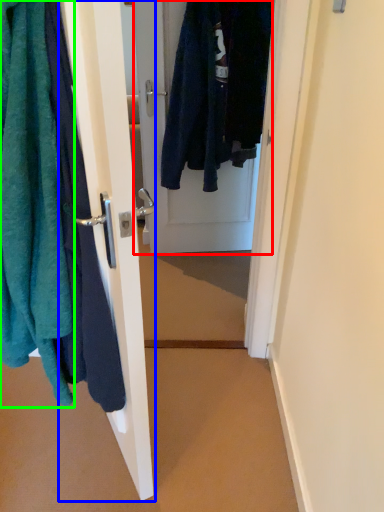
Question: Which object is the closest to the door (highlighted by a red box)? Choose among these: door (highlighted by a blue box) or towel (highlighted by a green box).

Choices:
 (A) door
 (B) towel

Answer: (A)